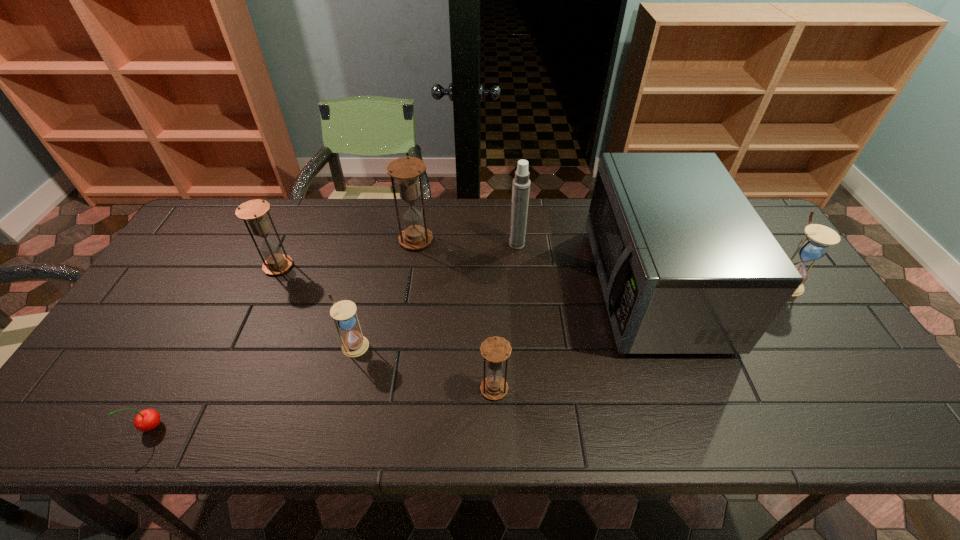
Point out which brown hourglass is positioned as the nearest to the second smallest brown hourglass. Please provide its 2D coordinates. Your answer should be formatted as a tuple, i.e. [(x, y)], where the tuple contains the x and y coordinates of a point satisfying the conditions above.

[(406, 170)]

At what (x,y) coordinates should I click in order to perform the action: click on vacant space that satisfies the following two spatial constraints: 1. on the front side of the fifth object from right to left; 2. on the right side of the fifth object from left to right. Please return your answer as a coordinate pair (x, y). Looking at the image, I should click on (394, 389).

Locate an element on the screen. This screenshot has width=960, height=540. vacant space that satisfies the following two spatial constraints: 1. on the back side of the aerosol can; 2. on the left side of the left white hourglass is located at coordinates (379, 245).